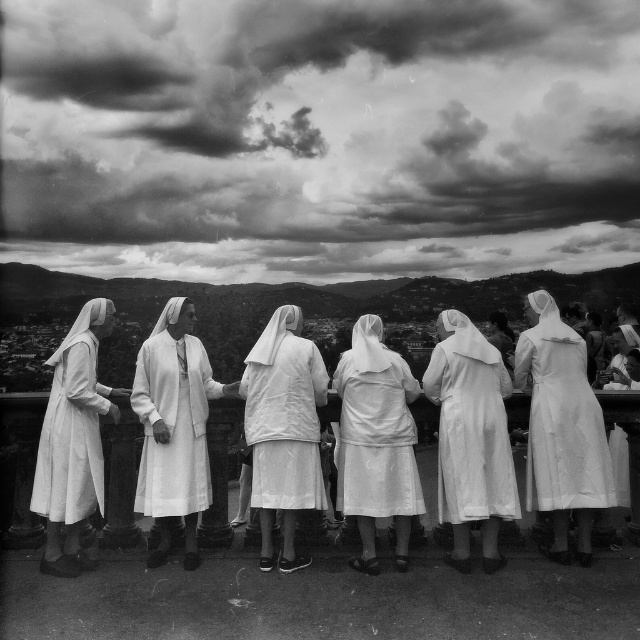
Question: Which object is positioned closest to the white satin nun at center?

Choices:
 (A) white matte dress at center
 (B) white matte nun's habit at center

Answer: (A)

Question: Is white satin nun's habit at center behind white matte dress at left?

Choices:
 (A) yes
 (B) no

Answer: (A)

Question: Is white satin nun at center bigger than white matte nun's habit at center?

Choices:
 (A) yes
 (B) no

Answer: (A)

Question: Does white matte coat at center lie behind white satin nun's habit at center?

Choices:
 (A) yes
 (B) no

Answer: (B)

Question: Which of the following is the closest to the observer?

Choices:
 (A) (342, 484)
 (B) (172, 492)

Answer: (B)

Question: Which of the following is the closest to the observer?

Choices:
 (A) (342, 400)
 (B) (552, 417)

Answer: (B)